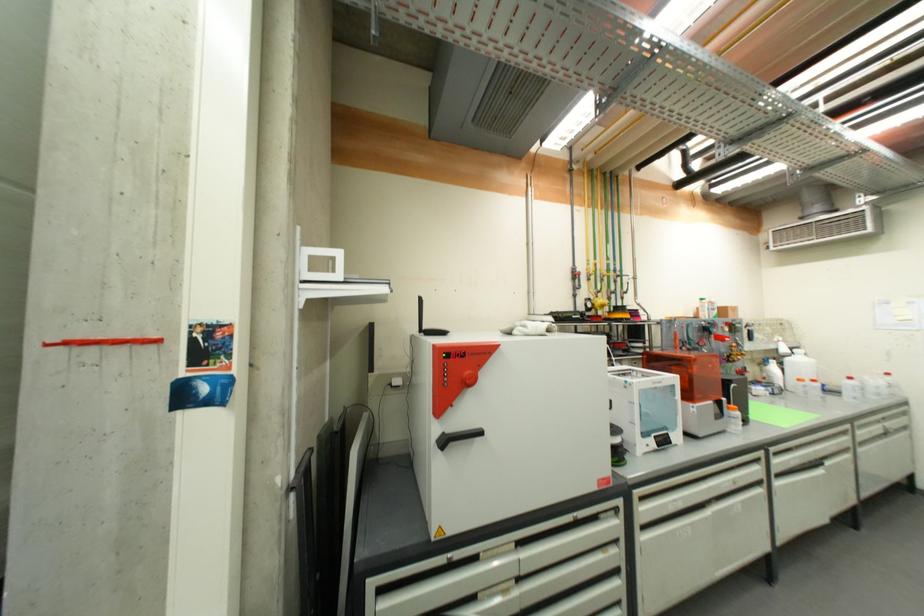
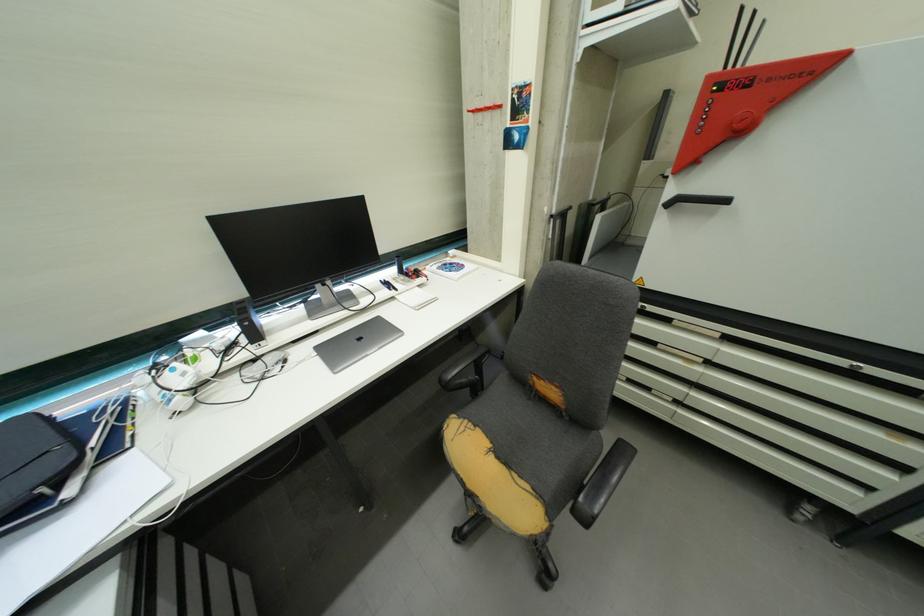
Where in the second image is the point corresponding to pixel 469 354 from the first image?

(759, 81)